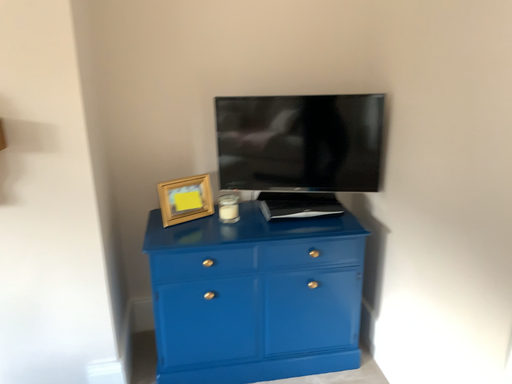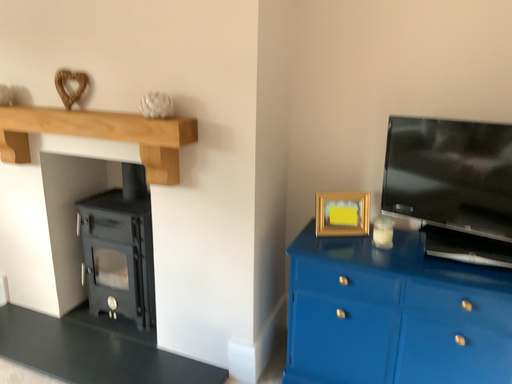
Question: How did the camera likely rotate when shooting the video?

Choices:
 (A) rotated left
 (B) rotated right

Answer: (A)